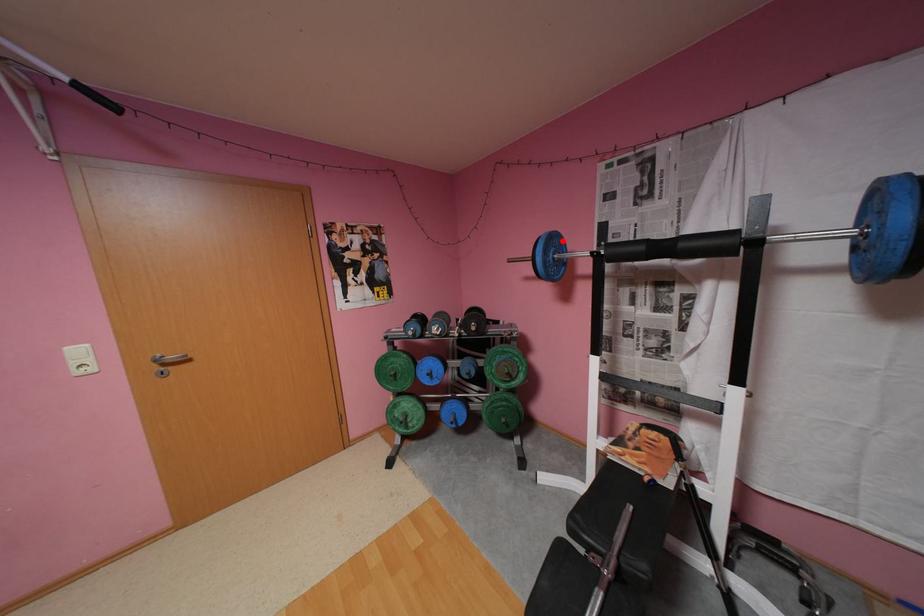
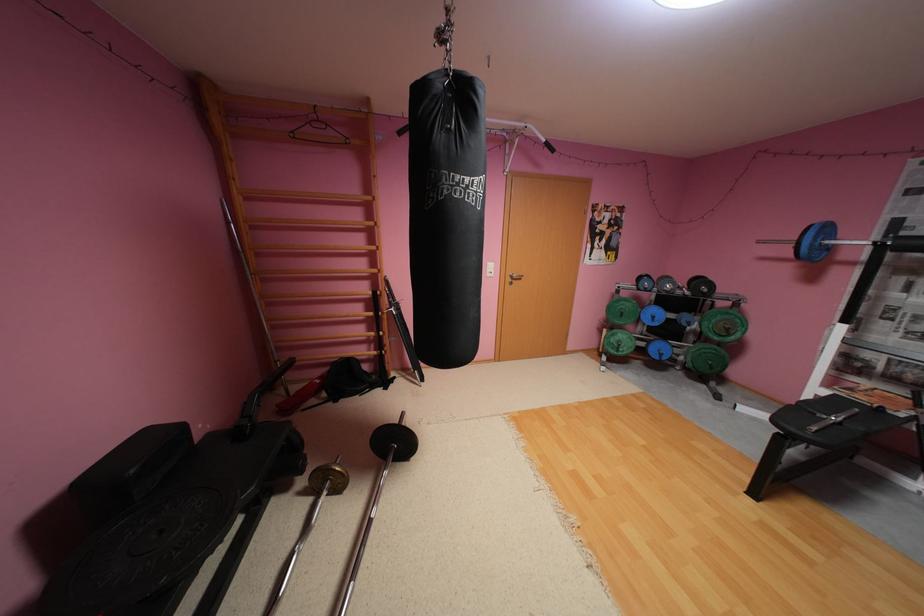
The point at the highlighted location is marked in the first image. Where is the corresponding point in the second image?

(835, 229)